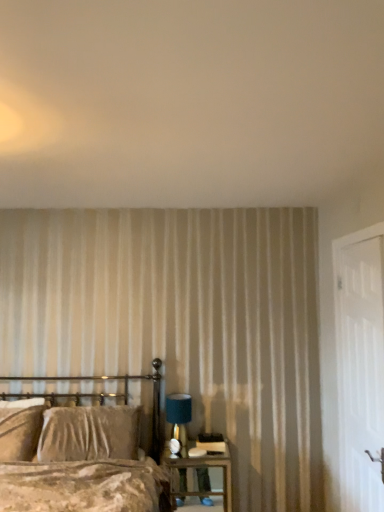
Question: Based on their positions, is velvet brown bed at lower left located to the left or right of white textured wall at upper center?

Choices:
 (A) right
 (B) left

Answer: (B)

Question: In the image, is velvet brown bed at lower left positioned in front of or behind white textured wall at upper center?

Choices:
 (A) behind
 (B) front

Answer: (B)

Question: Which is nearer to the velvet beige pillow at left?

Choices:
 (A) white wooden door at right
 (B) velvet brown bed at lower left
 (C) teal fabric lampshade at right
 (D) white textured wall at upper center
 (E) wooden nightstand at lower right

Answer: (B)

Question: Considering the real-world distances, which object is farthest from the velvet beige pillow at left?

Choices:
 (A) teal fabric lampshade at right
 (B) velvet brown bed at lower left
 (C) white wooden door at right
 (D) white textured wall at upper center
 (E) wooden nightstand at lower right

Answer: (D)